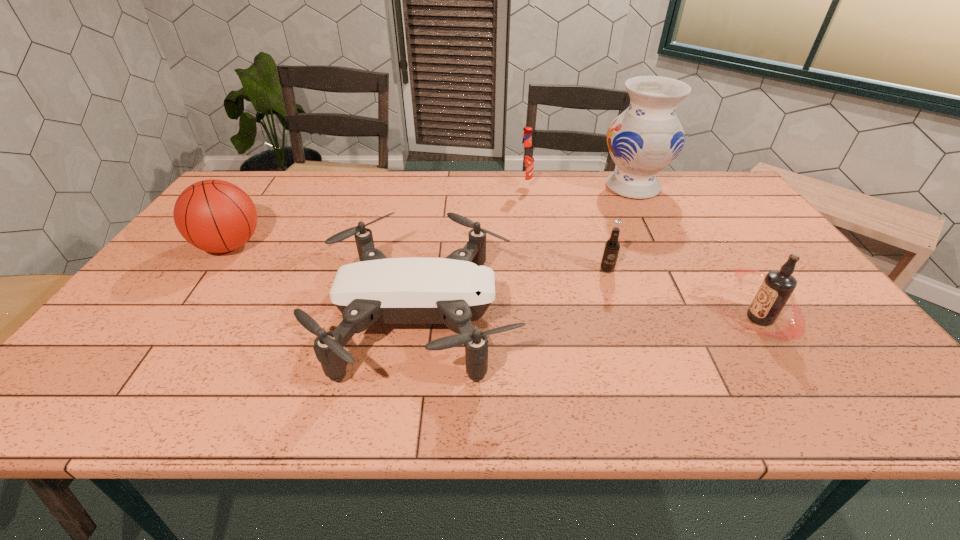
Image resolution: width=960 pixels, height=540 pixels. Find the location of `the tallest object`. the tallest object is located at coordinates (643, 140).

Identify the location of the leftmost root beer. This screenshot has width=960, height=540. (525, 160).

Where is `the farthest root beer`? the farthest root beer is located at coordinates (525, 160).

At what (x,y) coordinates should I click in order to perform the action: click on the leftmost object. Please return your answer as a coordinate pair (x, y). Image resolution: width=960 pixels, height=540 pixels. Looking at the image, I should click on (216, 216).

Where is `the rightmost root beer`? The height and width of the screenshot is (540, 960). the rightmost root beer is located at coordinates (778, 285).

Identify the location of the fourth object from left to right. This screenshot has width=960, height=540. (612, 246).

Locate an element on the screen. the second root beer from left to right is located at coordinates (612, 246).

Find the location of `drone`. drone is located at coordinates (457, 290).

Locate an element on the screen. The width and height of the screenshot is (960, 540). vacant space located 0.180m on the front of the tallest object is located at coordinates (659, 237).

The width and height of the screenshot is (960, 540). I want to click on vacant region located 0.310m on the left of the leftmost root beer, so click(427, 187).